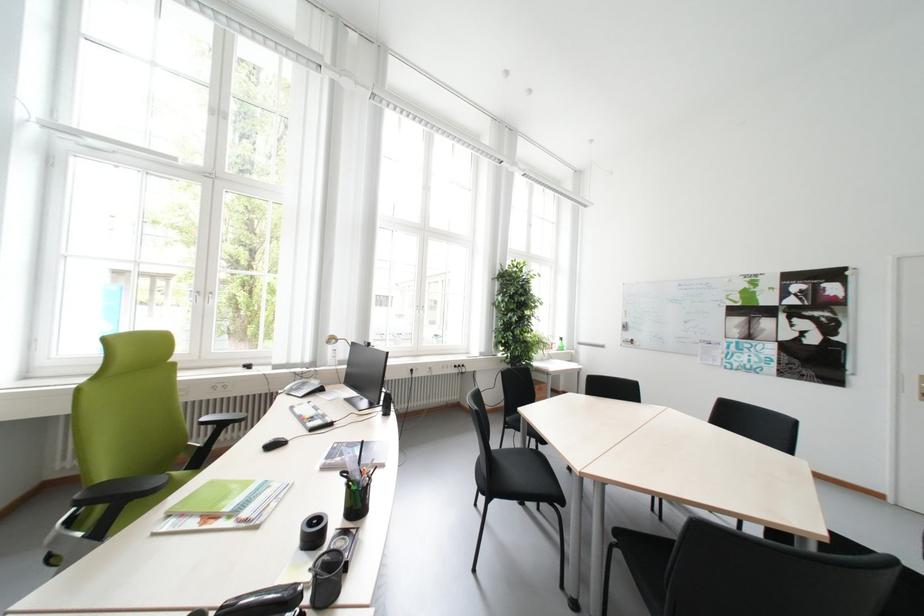
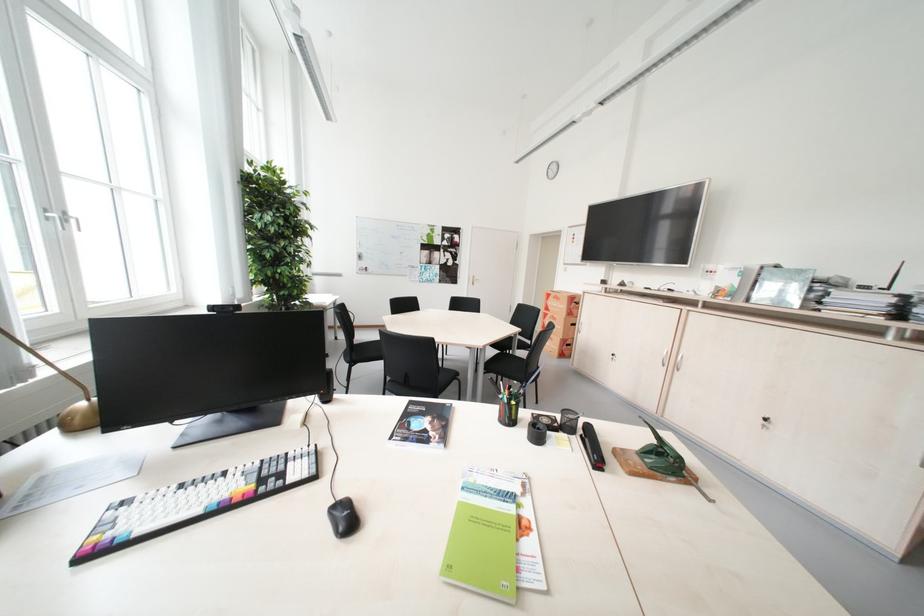
Locate, in the second image, the point that corresponds to point 284,448 in the first image.

(359, 521)